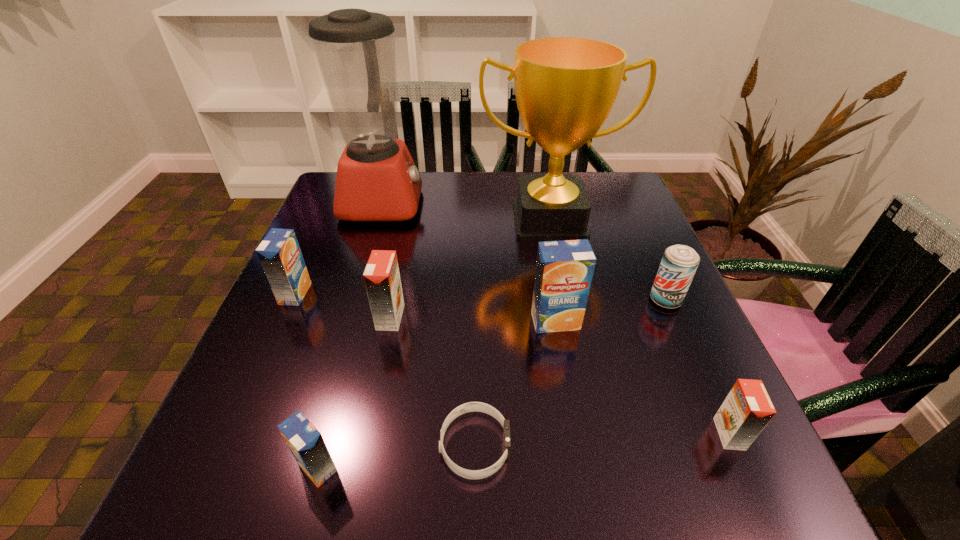
The height and width of the screenshot is (540, 960). I want to click on object identified as the fourth closest to the bigger orange orange juice, so click(377, 180).

Point out which orange juice is positioned as the fourth nearest to the blender. Please provide its 2D coordinates. Your answer should be formatted as a tuple, i.e. [(x, y)], where the tuple contains the x and y coordinates of a point satisfying the conditions above.

[(306, 443)]

Where is `orange juice that stands as the fourth closest to the rightmost orange juice`? orange juice that stands as the fourth closest to the rightmost orange juice is located at coordinates (279, 253).

Select which blue orange_juice is the third closest to the gold award. Please provide its 2D coordinates. Your answer should be formatted as a tuple, i.e. [(x, y)], where the tuple contains the x and y coordinates of a point satisfying the conditions above.

[(306, 443)]

At what (x,y) coordinates should I click in order to perform the action: click on blue orange_juice that is the second closest to the rightmost blue orange_juice. Please return your answer as a coordinate pair (x, y). Looking at the image, I should click on (279, 253).

Identify the location of free space that satisfies the following two spatial constraints: 1. on the front-facing side of the award; 2. on the outer surface of the wristband. (596, 446).

Find the location of a particular element. This screenshot has height=540, width=960. free space that satisfies the following two spatial constraints: 1. on the back side of the biggest blue orange_juice; 2. on the right side of the second blue orange_juice from right to left is located at coordinates (358, 321).